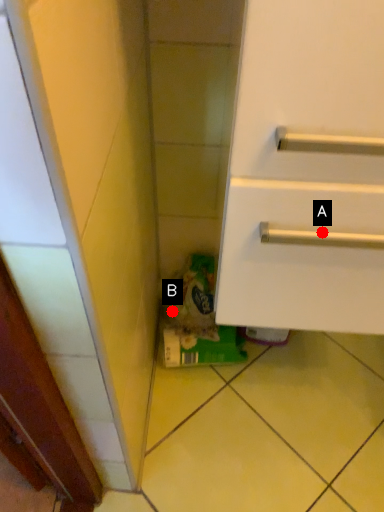
Question: Two points are circled on the image, labeled by A and B beside each circle. Which point appears closest to the camera in this image?

Choices:
 (A) A is closer
 (B) B is closer

Answer: (A)